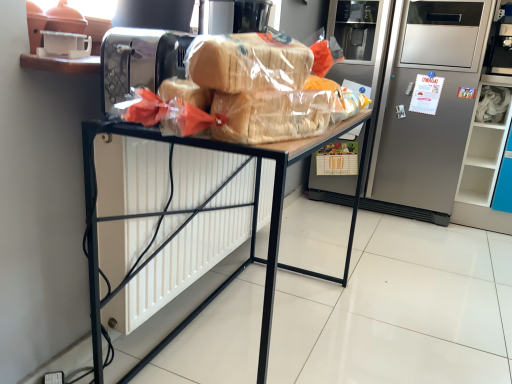
Measure the distance between point (275, 61) and camera.

They are 81.20 centimeters apart.

Find the location of a particular element. The width and height of the screenshot is (512, 384). translucent plastic bread at center is located at coordinates (248, 62).

The height and width of the screenshot is (384, 512). What do you see at coordinates (271, 116) in the screenshot?
I see `translucent plastic bread at center` at bounding box center [271, 116].

This screenshot has height=384, width=512. I want to click on wooden desk at center, so click(216, 209).

How many degrees apart are the facing directions of wooden desk at center and satin silver refrigerator at center?

There is a 91.6-degree angle between the facing directions of wooden desk at center and satin silver refrigerator at center.

How much distance is there between wooden desk at center and satin silver refrigerator at center?

wooden desk at center and satin silver refrigerator at center are 35.62 inches apart.

Where is `desk directly beneath the satin silver refrigerator at center (from a real-world perspective)`? This screenshot has height=384, width=512. desk directly beneath the satin silver refrigerator at center (from a real-world perspective) is located at coordinates (216, 209).

Is wooden desk at center closer to camera compared to satin silver refrigerator at center?

Yes, wooden desk at center is in front of satin silver refrigerator at center.

Does translucent plastic bread at center have a smaller size compared to translucent plastic bread at center?

No.

In the image, is translucent plastic bread at center positioned in front of or behind translucent plastic bread at center?

translucent plastic bread at center is positioned farther from the viewer than translucent plastic bread at center.

Is translucent plastic bread at center not inside translucent plastic bread at center?

translucent plastic bread at center is positioned outside translucent plastic bread at center.

From the picture: Between translucent plastic bread at center and translucent plastic bread at center, which one appears on the right side from the viewer's perspective?

translucent plastic bread at center is more to the right.

In terms of height, does satin silver refrigerator at center look taller or shorter compared to translucent plastic bread at center?

satin silver refrigerator at center is taller than translucent plastic bread at center.

Which of these two, satin silver refrigerator at center or translucent plastic bread at center, is smaller?

With smaller size is translucent plastic bread at center.

Relative to translucent plastic bread at center, is satin silver refrigerator at center in front or behind?

satin silver refrigerator at center is positioned farther from the viewer than translucent plastic bread at center.

Which object is wider, wooden desk at center or translucent plastic bread at center?

wooden desk at center.

Can you confirm if wooden desk at center is smaller than translucent plastic bread at center?

Incorrect, wooden desk at center is not smaller in size than translucent plastic bread at center.

From the image's perspective, who appears lower, wooden desk at center or translucent plastic bread at center?

wooden desk at center.

Identify the location of snack below the satin silver refrigerator at center (from the image's perspective). This screenshot has height=384, width=512. (271, 116).

Considering the relative sizes of translucent plastic bread at center and satin silver refrigerator at center in the image provided, is translucent plastic bread at center wider than satin silver refrigerator at center?

No, translucent plastic bread at center is not wider than satin silver refrigerator at center.

Is translucent plastic bread at center turned away from satin silver refrigerator at center?

translucent plastic bread at center does not have its back to satin silver refrigerator at center.

From the image's perspective, is translucent plastic bread at center on top of satin silver refrigerator at center?

No, from the image's perspective, translucent plastic bread at center is not above satin silver refrigerator at center.

Does translucent plastic bread at center have a greater width compared to wooden desk at center?

No.

Considering the positions of points (224, 65) and (265, 284), is point (224, 65) closer to camera compared to point (265, 284)?

Yes.

Is translucent plastic bread at center shorter than wooden desk at center?

Correct, translucent plastic bread at center is not as tall as wooden desk at center.

Is translucent plastic bread at center in front of or behind wooden desk at center in the image?

Visually, translucent plastic bread at center is located in front of wooden desk at center.

From a real-world perspective, is wooden desk at center located higher than translucent plastic bread at center?

No, from a real-world perspective, wooden desk at center is not above translucent plastic bread at center.

Looking at this image, is there a large distance between wooden desk at center and translucent plastic bread at center?

No.

Who is smaller, wooden desk at center or translucent plastic bread at center?

With smaller size is translucent plastic bread at center.

I want to click on refrigerator that appears above the wooden desk at center (from the image's perspective), so click(428, 113).

Where is `snack below the translucent plastic bread at center (from the image's perspective)`? The width and height of the screenshot is (512, 384). snack below the translucent plastic bread at center (from the image's perspective) is located at coordinates (271, 116).

When comparing their distances from satin silver refrigerator at center, does translucent plastic bread at center or translucent plastic bread at center seem closer?

Based on the image, translucent plastic bread at center appears to be nearer to satin silver refrigerator at center.

Based on their spatial positions, is satin silver refrigerator at center or wooden desk at center closer to translucent plastic bread at center?

The object closer to translucent plastic bread at center is wooden desk at center.

Looking at the image, which one is located further to translucent plastic bread at center, translucent plastic bread at center or wooden desk at center?

wooden desk at center is further to translucent plastic bread at center.

Estimate the real-world distances between objects in this image. Which object is closer to satin silver refrigerator at center, translucent plastic bread at center or wooden desk at center?

wooden desk at center.

Based on the photo, looking at the image, which one is located closer to translucent plastic bread at center, wooden desk at center or translucent plastic bread at center?

translucent plastic bread at center.

When comparing their distances from satin silver refrigerator at center, does translucent plastic bread at center or wooden desk at center seem further?

translucent plastic bread at center is positioned further to the anchor satin silver refrigerator at center.

Looking at the image, which one is located further to satin silver refrigerator at center, translucent plastic bread at center or translucent plastic bread at center?

translucent plastic bread at center is further to satin silver refrigerator at center.

Based on their spatial positions, is wooden desk at center or satin silver refrigerator at center closer to translucent plastic bread at center?

The object closer to translucent plastic bread at center is wooden desk at center.

This screenshot has height=384, width=512. I want to click on bread between translucent plastic bread at center and satin silver refrigerator at center in the front-back direction, so click(x=248, y=62).

Identify the location of snack between translucent plastic bread at center and wooden desk at center in the up-down direction. This screenshot has height=384, width=512. (271, 116).

Where is `desk positioned between translucent plastic bread at center and satin silver refrigerator at center from near to far`? desk positioned between translucent plastic bread at center and satin silver refrigerator at center from near to far is located at coordinates (216, 209).

Locate an element on the screen. The image size is (512, 384). desk between translucent plastic bread at center and satin silver refrigerator at center along the z-axis is located at coordinates (216, 209).